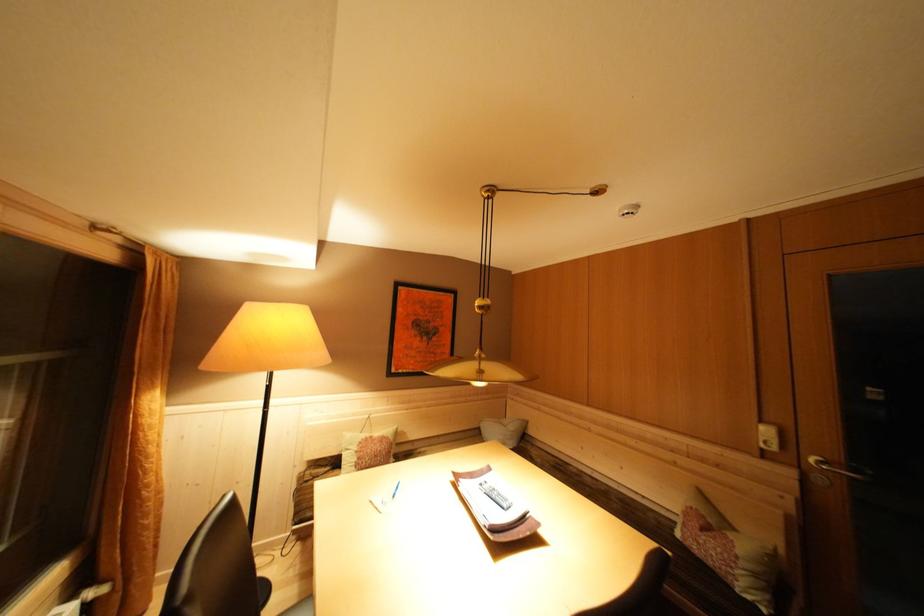
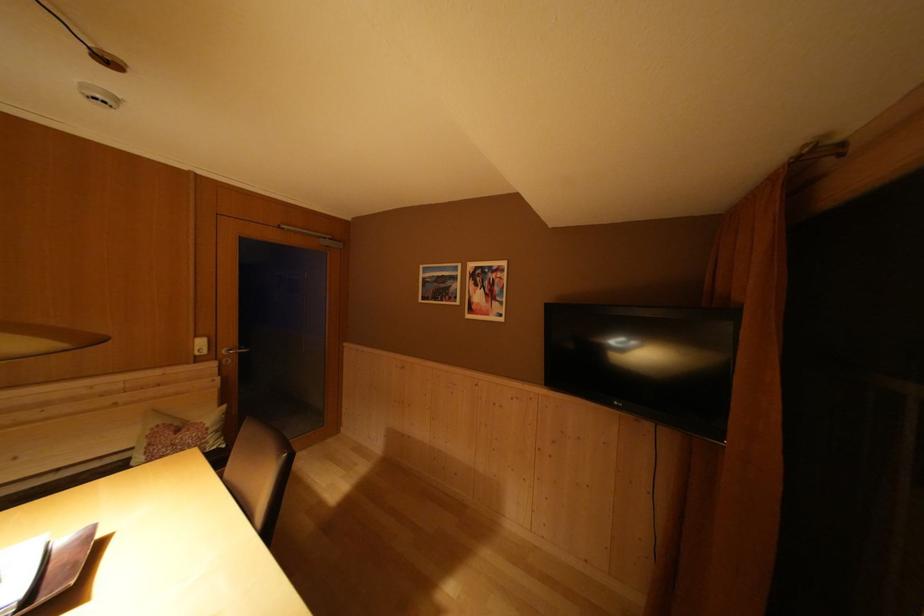
Locate, in the second image, the point that corresponds to point (811, 485) in the first image.

(226, 371)